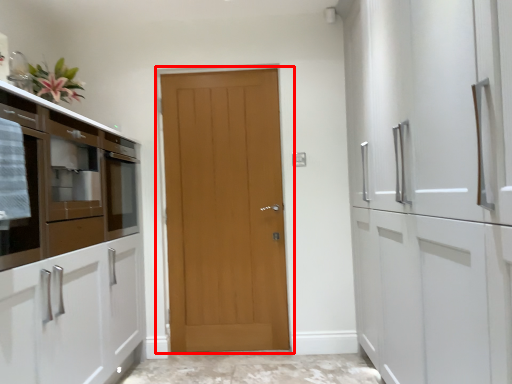
Question: Considering the relative positions of door (annotated by the red box) and cabinetry in the image provided, where is door (annotated by the red box) located with respect to the staircase?

Choices:
 (A) right
 (B) left

Answer: (A)